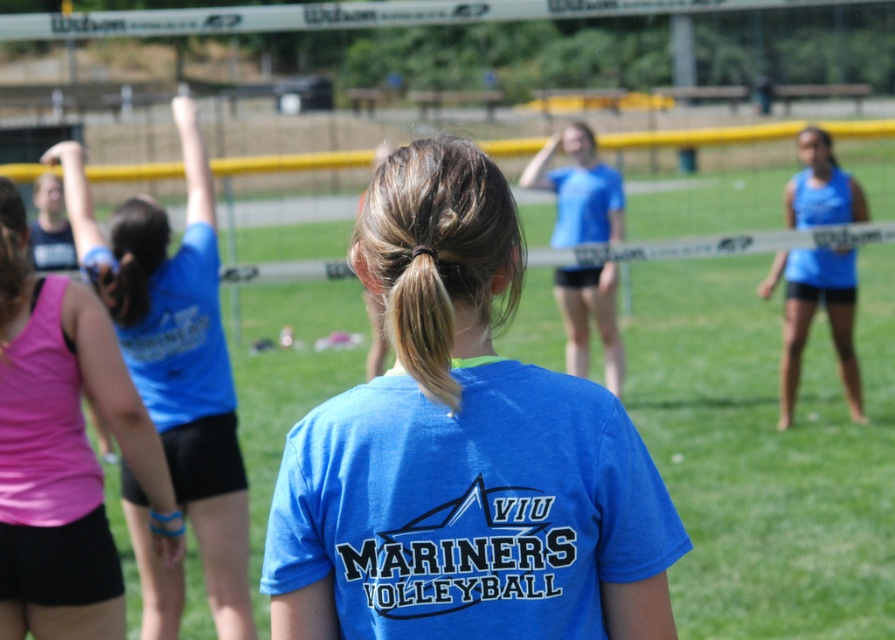
Question: Does blue matte shirt at center have a greater width compared to blue matte shorts at right?

Choices:
 (A) no
 (B) yes

Answer: (A)

Question: Which object is the farthest from the blue matte shorts at right?

Choices:
 (A) pink fabric shorts at left
 (B) blue matte shirt at center
 (C) blue jersey at upper left

Answer: (B)

Question: Which object appears farthest from the camera in this image?

Choices:
 (A) pink fabric shorts at left
 (B) blue matte shirt at center

Answer: (A)

Question: Is blue matte shirt at center positioned before blue jersey at upper left?

Choices:
 (A) no
 (B) yes

Answer: (B)

Question: Can you confirm if blue jersey at upper left is thinner than blue matte shorts at right?

Choices:
 (A) no
 (B) yes

Answer: (B)

Question: Which is farther from the pink fabric shorts at left?

Choices:
 (A) blue matte shorts at right
 (B) blue matte shirt at center

Answer: (A)